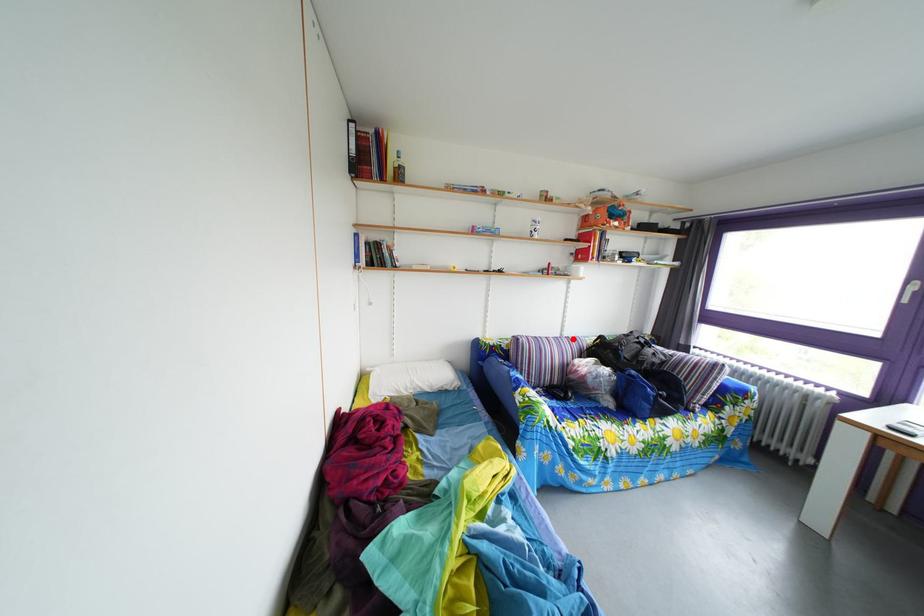
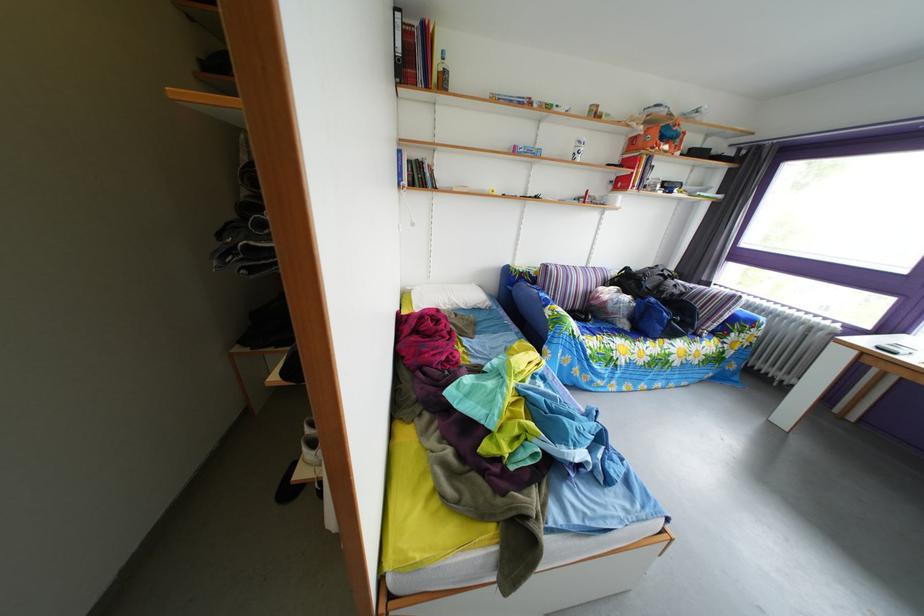
In the second image, find the point that corresponds to the highlighted location in the first image.

(599, 270)